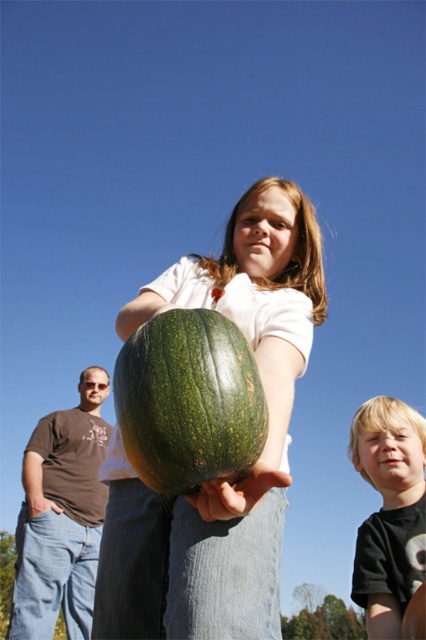
Which is behind, point (238, 301) or point (224, 316)?

Positioned behind is point (238, 301).

Describe the element at coordinates (218, 480) in the screenshot. The image size is (426, 640). I see `green matte pumpkin at center` at that location.

Who is more distant from viewer, (270, 196) or (210, 403)?

The point (270, 196) is behind.

Locate an element on the screen. green matte pumpkin at center is located at coordinates (218, 480).

Does brown cotton shirt at left have a greater width compared to blonde hair boy at lower right?

In fact, brown cotton shirt at left might be narrower than blonde hair boy at lower right.

Does brown cotton shirt at left have a greater height compared to blonde hair boy at lower right?

No, brown cotton shirt at left is not taller than blonde hair boy at lower right.

This screenshot has width=426, height=640. In order to click on brown cotton shirt at left in this screenshot , I will do `click(62, 516)`.

Locate an element on the screen. This screenshot has width=426, height=640. brown cotton shirt at left is located at coordinates (62, 516).

Measure the distance between green matte/glossy gourd at center and brown cotton shirt at left.

A distance of 21.25 feet exists between green matte/glossy gourd at center and brown cotton shirt at left.

Is green matte/glossy gourd at center wider than brown cotton shirt at left?

In fact, green matte/glossy gourd at center might be narrower than brown cotton shirt at left.

Where is `green matte/glossy gourd at center`? This screenshot has width=426, height=640. green matte/glossy gourd at center is located at coordinates (189, 401).